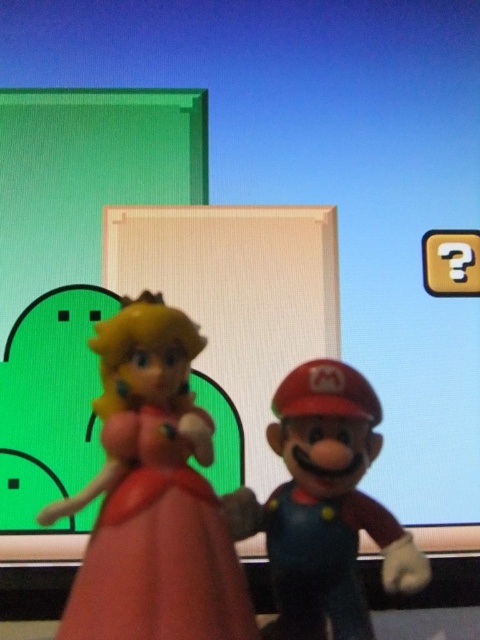
Question: Which point is farther to the camera?

Choices:
 (A) (283, 545)
 (B) (118, 428)

Answer: (A)

Question: Which point is closer to the camera?

Choices:
 (A) matte pink princess at center
 (B) matte plastic mario at center

Answer: (A)

Question: From the image, what is the correct spatial relationship of matte pink princess at center in relation to matte plastic mario at center?

Choices:
 (A) left
 (B) right

Answer: (A)

Question: Does matte pink princess at center have a greater width compared to matte plastic mario at center?

Choices:
 (A) no
 (B) yes

Answer: (B)

Question: Observing the image, what is the correct spatial positioning of matte pink princess at center in reference to matte plastic mario at center?

Choices:
 (A) above
 (B) below

Answer: (A)